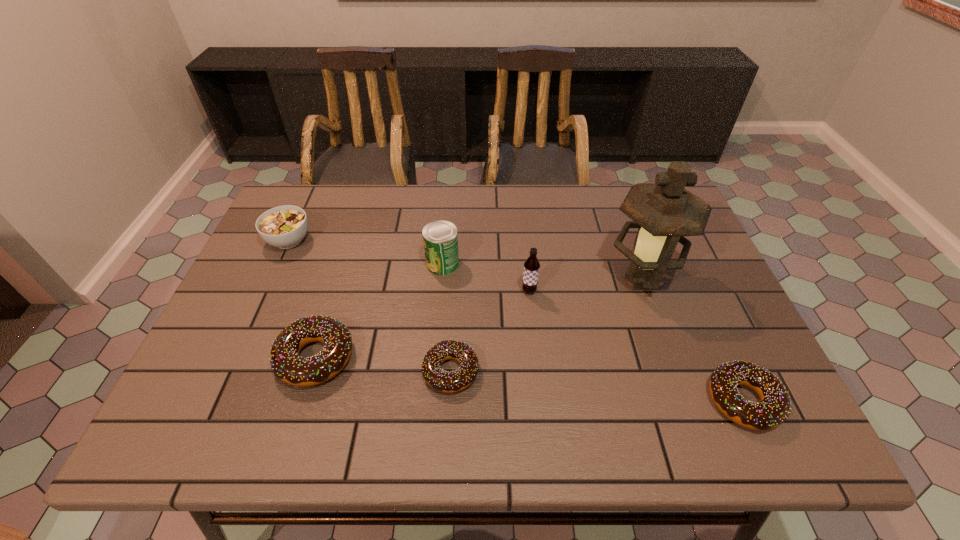
Locate an element on the screen. This screenshot has width=960, height=540. the leftmost doughnut is located at coordinates (287, 365).

This screenshot has width=960, height=540. I want to click on the second doughnut from left to right, so click(x=449, y=382).

Locate an element on the screen. the shortest object is located at coordinates (449, 382).

Find the location of a particular element. Image resolution: width=960 pixels, height=540 pixels. the rightmost doughnut is located at coordinates (774, 408).

At what (x,y) coordinates should I click in order to perform the action: click on the sixth tallest object. Please return your answer as a coordinate pair (x, y). Looking at the image, I should click on (774, 408).

At what (x,y) coordinates should I click in order to perform the action: click on oil lamp. Please return your answer as a coordinate pair (x, y). The image size is (960, 540). Looking at the image, I should click on (664, 212).

Where is `the fourth shortest object`? the fourth shortest object is located at coordinates (285, 226).

I want to click on the leftmost object, so click(285, 226).

Where is `can`? The image size is (960, 540). can is located at coordinates (440, 237).

You are a GUI agent. You are given a task and a screenshot of the screen. Output one action in this format:
    pyautogui.click(x=<x>, y=<y>)
    Task: Click on the root beer
    
    Given the screenshot: What is the action you would take?
    click(531, 266)